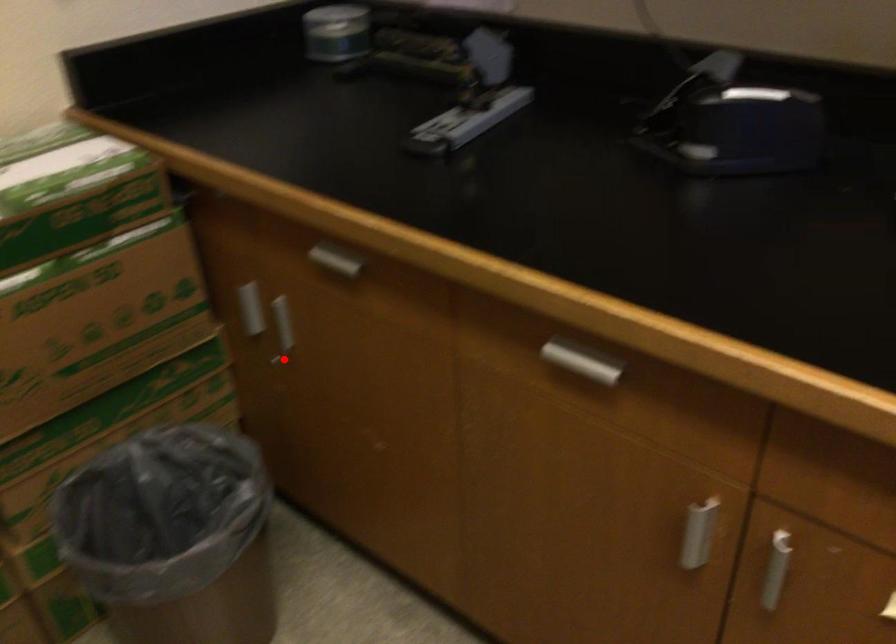
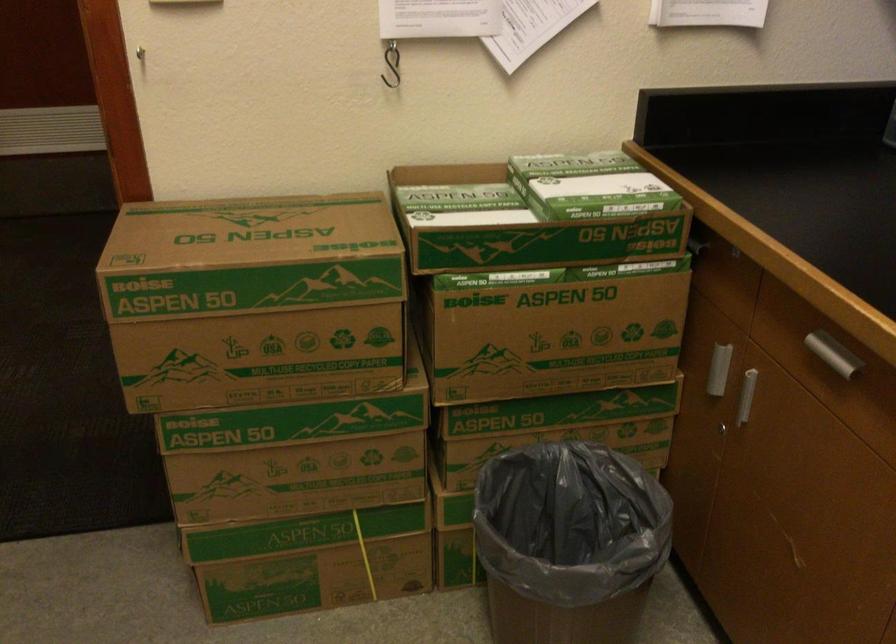
The point at the highlighted location is marked in the first image. Where is the corresponding point in the second image?

(727, 433)